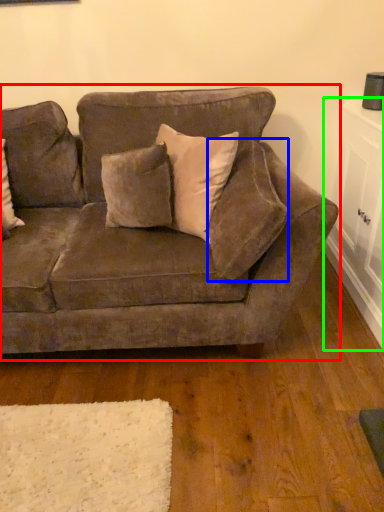
Question: Based on their relative distances, which object is farther from studio couch (highlighted by a red box)? Choose from pillow (highlighted by a blue box) and table (highlighted by a green box).

Choices:
 (A) pillow
 (B) table

Answer: (B)